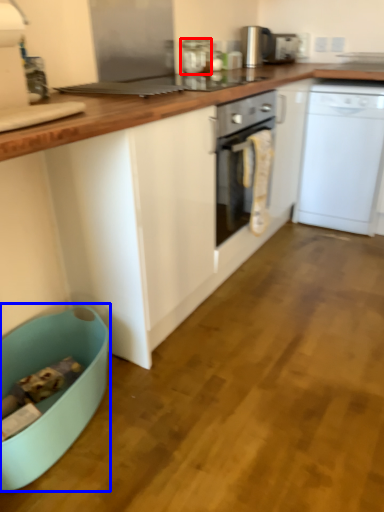
Question: Which of the following is the farthest to the observer, kitchen appliance (highlighted by a red box) or dish washer (highlighted by a blue box)?

Choices:
 (A) kitchen appliance
 (B) dish washer

Answer: (A)